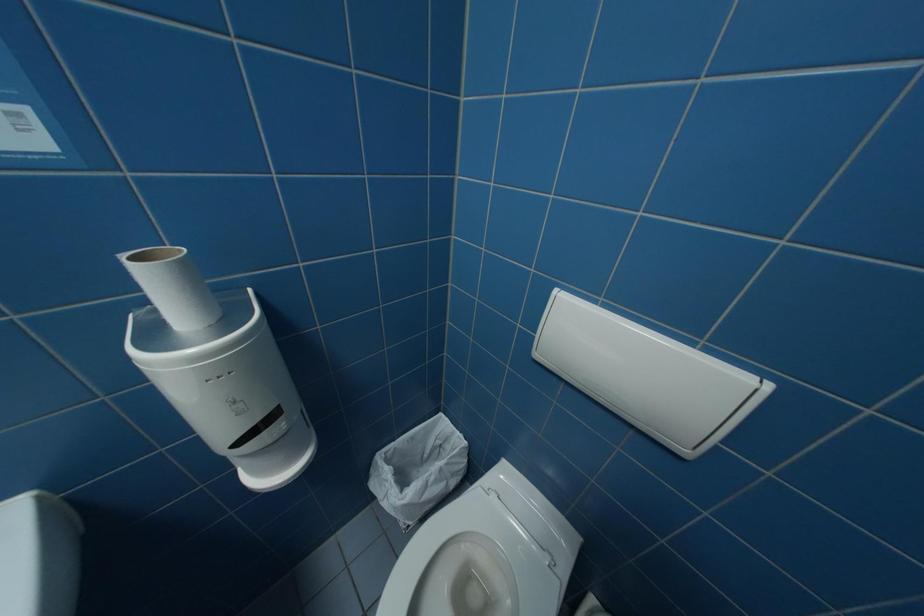
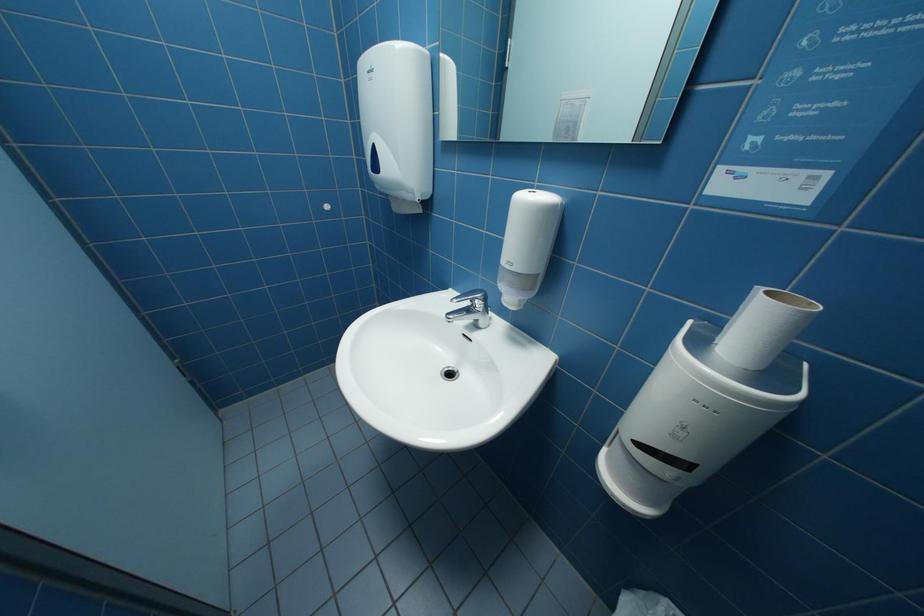
Consider the image. Based on the continuous images, in which direction is the camera rotating?

The rotation direction of the camera is left-down.